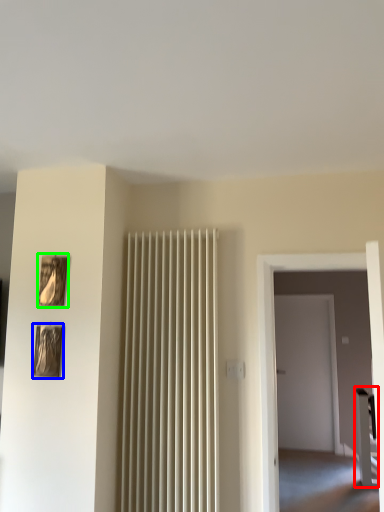
Question: Which object is positioned closest to furniture (highlighted by a red box)? Select from picture frame (highlighted by a blue box) and picture frame (highlighted by a green box).

Choices:
 (A) picture frame
 (B) picture frame

Answer: (A)